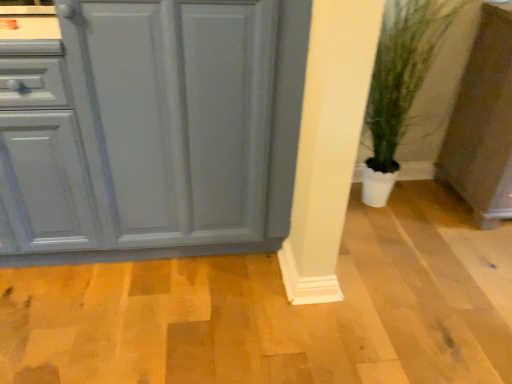
Question: Based on their positions, is green leafy plant in pot at lower right located to the left or right of matte gray cabinet at lower right, which is the 1th cabinetry from right to left?

Choices:
 (A) left
 (B) right

Answer: (A)

Question: From a real-world perspective, is green leafy plant in pot at lower right above or below matte gray cabinet at lower right, which is the 1th cabinetry from right to left?

Choices:
 (A) below
 (B) above

Answer: (B)

Question: Estimate the real-world distances between objects in this image. Which object is closer to the matte gray cabinet at lower right, which is the second cabinetry from left to right?

Choices:
 (A) matte gray cabinet at left, which appears as the first cabinetry when viewed from the left
 (B) green leafy plant in pot at lower right

Answer: (B)

Question: Based on their relative distances, which object is nearer to the matte gray cabinet at lower right, which is the second cabinetry from left to right?

Choices:
 (A) matte gray cabinet at left, which appears as the first cabinetry when viewed from the left
 (B) green leafy plant in pot at lower right

Answer: (B)